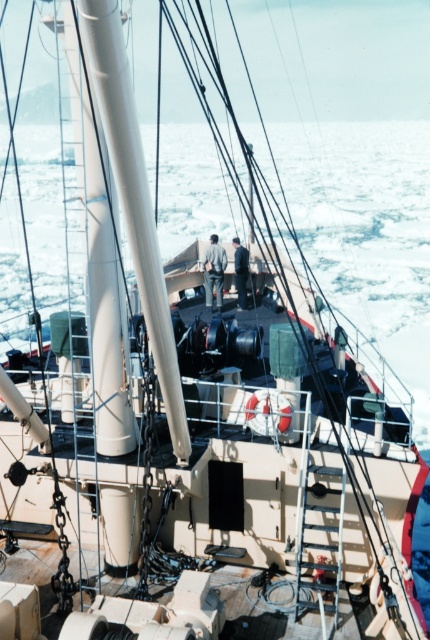
Question: Does dark gray fabric pants at center have a lesser width compared to dark gray fabric jacket at center?

Choices:
 (A) no
 (B) yes

Answer: (A)

Question: Is dark gray fabric pants at center to the left of dark gray fabric jacket at center from the viewer's perspective?

Choices:
 (A) yes
 (B) no

Answer: (A)

Question: Which point appears farthest from the camera in this image?

Choices:
 (A) (215, 268)
 (B) (240, 296)

Answer: (A)

Question: Is dark gray fabric pants at center closer to camera compared to dark gray fabric jacket at center?

Choices:
 (A) yes
 (B) no

Answer: (A)

Question: Among these points, which one is farthest from the camera?

Choices:
 (A) (220, 269)
 (B) (237, 248)

Answer: (B)